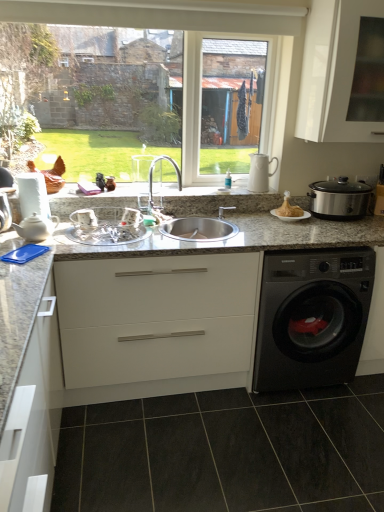
Identify the location of vacant area on top of white ceramic pitcher at upper right, the second appliance in the left-to-right sequence (from a real-world perspective). Image resolution: width=384 pixels, height=512 pixels. (272, 144).